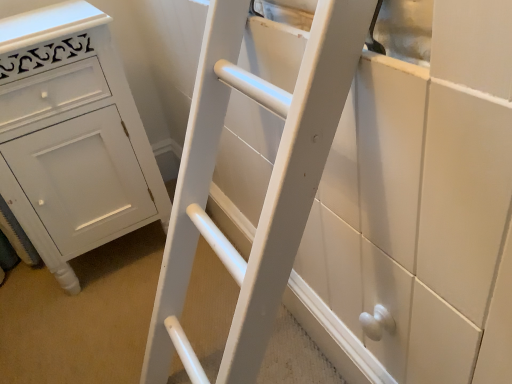
This screenshot has height=384, width=512. What are the coordinates of `white painted wood chest of drawers at left` in the screenshot? It's located at (72, 138).

What do you see at coordinates (72, 138) in the screenshot?
I see `white painted wood chest of drawers at left` at bounding box center [72, 138].

At what (x,y) coordinates should I click in order to perform the action: click on white matte ladder at center. Please return your answer as a coordinate pair (x, y). This screenshot has width=512, height=384. Looking at the image, I should click on (268, 186).

This screenshot has height=384, width=512. Describe the element at coordinates (268, 186) in the screenshot. I see `white matte ladder at center` at that location.

Where is `white painted wood chest of drawers at left`? The height and width of the screenshot is (384, 512). white painted wood chest of drawers at left is located at coordinates (72, 138).

Considering the relative positions of white matte ladder at center and white painted wood chest of drawers at left in the image provided, is white matte ladder at center to the left or to the right of white painted wood chest of drawers at left?

In the image, white matte ladder at center appears on the right side of white painted wood chest of drawers at left.

Considering their positions, is white matte ladder at center located in front of or behind white painted wood chest of drawers at left?

white matte ladder at center is in front of white painted wood chest of drawers at left.

Is point (191, 368) closer to viewer compared to point (28, 21)?

Yes, it is in front of point (28, 21).

From the image's perspective, which object appears higher, white matte ladder at center or white painted wood chest of drawers at left?

white painted wood chest of drawers at left, from the image's perspective.

From a real-world perspective, is white matte ladder at center below white painted wood chest of drawers at left?

Yes.

Does white matte ladder at center have a lesser width compared to white painted wood chest of drawers at left?

Yes.

Who is taller, white matte ladder at center or white painted wood chest of drawers at left?

With more height is white painted wood chest of drawers at left.

Is white matte ladder at center bigger or smaller than white painted wood chest of drawers at left?

Considering their sizes, white matte ladder at center takes up less space than white painted wood chest of drawers at left.

Is white painted wood chest of drawers at left completely or partially inside white matte ladder at center?

That's incorrect, white painted wood chest of drawers at left is not inside white matte ladder at center.

Looking at this image, is white matte ladder at center far from white painted wood chest of drawers at left?

No, white matte ladder at center is not far from white painted wood chest of drawers at left.

Could you tell me if white matte ladder at center is facing white painted wood chest of drawers at left?

No.

What's the angular difference between white matte ladder at center and white painted wood chest of drawers at left's facing directions?

There is a 91.8-degree angle between the facing directions of white matte ladder at center and white painted wood chest of drawers at left.

Measure the distance from white matte ladder at center to white painted wood chest of drawers at left.

The distance of white matte ladder at center from white painted wood chest of drawers at left is 18.29 inches.

This screenshot has width=512, height=384. Find the location of `chest of drawers on the left of white matte ladder at center`. chest of drawers on the left of white matte ladder at center is located at coordinates (72, 138).

Based on their positions, is white painted wood chest of drawers at left located to the left or right of white matte ladder at center?

Clearly, white painted wood chest of drawers at left is on the left of white matte ladder at center in the image.

Is the depth of white painted wood chest of drawers at left greater than that of white matte ladder at center?

Yes, it is.

Is point (108, 138) in front of point (315, 106)?

No, it is not.

From the image's perspective, does white painted wood chest of drawers at left appear lower than white matte ladder at center?

No, from the image's perspective, white painted wood chest of drawers at left is not below white matte ladder at center.

From a real-world perspective, between white painted wood chest of drawers at left and white matte ladder at center, who is vertically lower?

In real-world perspective, white matte ladder at center is lower.

Between white painted wood chest of drawers at left and white matte ladder at center, which one has smaller width?

white matte ladder at center is thinner.

In terms of height, does white painted wood chest of drawers at left look taller or shorter compared to white matte ladder at center?

In the image, white painted wood chest of drawers at left appears to be taller than white matte ladder at center.

Looking at the image, does white painted wood chest of drawers at left seem bigger or smaller compared to white matte ladder at center?

Clearly, white painted wood chest of drawers at left is larger in size than white matte ladder at center.

Can we say white painted wood chest of drawers at left lies outside white matte ladder at center?

white painted wood chest of drawers at left lies outside white matte ladder at center's area.

Is white painted wood chest of drawers at left far from white matte ladder at center?

white painted wood chest of drawers at left is near white matte ladder at center, not far away.

Could you tell me if white painted wood chest of drawers at left is facing white matte ladder at center?

No, white painted wood chest of drawers at left is not turned towards white matte ladder at center.

Can you tell me how much white painted wood chest of drawers at left and white matte ladder at center differ in facing direction?

91.8 degrees.

From the picture: How much distance is there between white painted wood chest of drawers at left and white matte ladder at center?

46.46 centimeters.

The image size is (512, 384). In order to click on chest of drawers lying on the left of white matte ladder at center in this screenshot , I will do `click(72, 138)`.

Find the location of a particular element. ladder in front of the white painted wood chest of drawers at left is located at coordinates (268, 186).

Identify the location of ladder that is below the white painted wood chest of drawers at left (from the image's perspective). (268, 186).